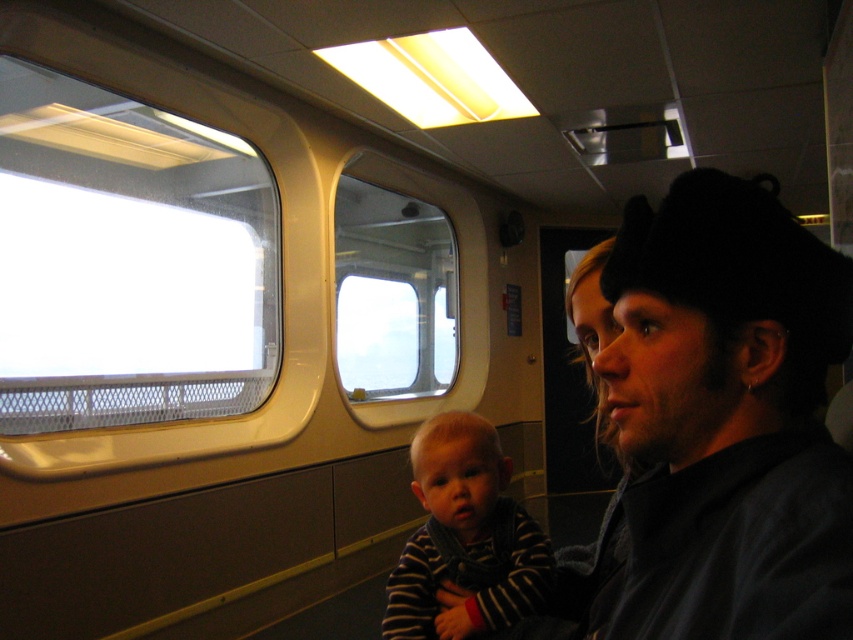
Question: Does transparent glass window at upper left have a greater width compared to clear glass window at center?

Choices:
 (A) no
 (B) yes

Answer: (B)

Question: From the image, what is the correct spatial relationship of black knit cap at upper right in relation to transparent glass window at upper left?

Choices:
 (A) above
 (B) below

Answer: (B)

Question: Which is farther from the striped fabric baby at center?

Choices:
 (A) clear glass window at center
 (B) transparent glass window at upper left

Answer: (A)

Question: Is striped fabric baby at center thinner than clear glass window at center?

Choices:
 (A) yes
 (B) no

Answer: (A)

Question: Which object is closer to the camera taking this photo?

Choices:
 (A) clear glass window at center
 (B) black knit cap at upper right

Answer: (B)

Question: Which object is farther from the camera taking this photo?

Choices:
 (A) transparent glass window at upper left
 (B) striped fabric baby at center
 (C) black knit cap at upper right

Answer: (A)